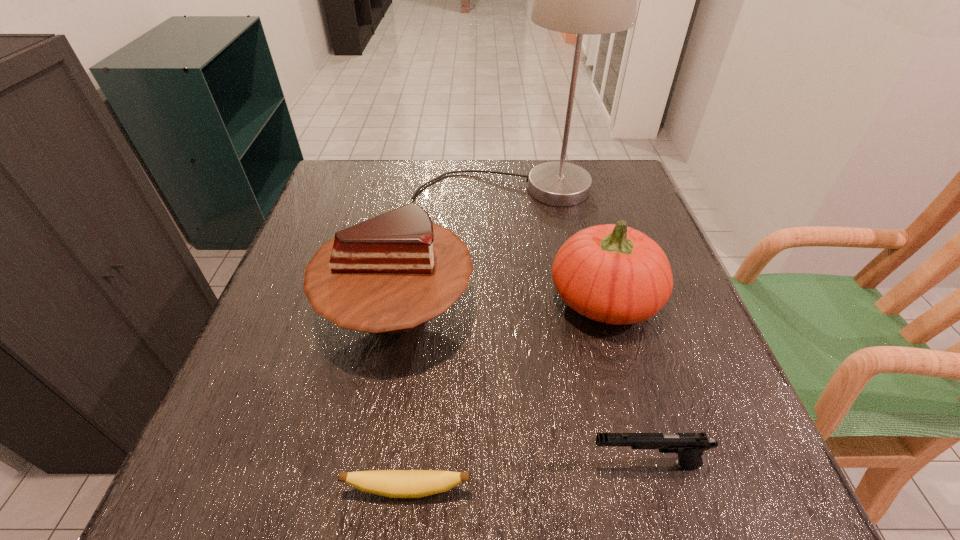
Locate which object is the second closest to the tallest object. Please provide its 2D coordinates. Your answer should be formatted as a tuple, i.e. [(x, y)], where the tuple contains the x and y coordinates of a point satisfying the conditions above.

[(611, 273)]

Identify the location of object that can be found as the third closest to the banana. This screenshot has width=960, height=540. (611, 273).

Locate an element on the screen. The image size is (960, 540). free space that satisfies the following two spatial constraints: 1. on the front side of the pumpkin; 2. at the aiming end of the gun is located at coordinates (650, 464).

You are a GUI agent. You are given a task and a screenshot of the screen. Output one action in this format:
    pyautogui.click(x=<x>, y=<y>)
    Task: Click on the free space in the image that satisfies the following two spatial constraints: 1. on the back side of the pumpkin; 2. on the right side of the nearest object
    
    Given the screenshot: What is the action you would take?
    pos(429,299)

Locate an element on the screen. Image resolution: width=960 pixels, height=540 pixels. free region that satisfies the following two spatial constraints: 1. on the front side of the pumpkin; 2. on the left side of the farthest object is located at coordinates (515, 299).

The image size is (960, 540). What are the coordinates of `vacant region that satisfies the following two spatial constraints: 1. on the front side of the pumpkin; 2. at the aiming end of the gun` in the screenshot? It's located at (650, 464).

Identify the location of vacant space that satisfies the following two spatial constraints: 1. on the back side of the shortest object; 2. on the left side of the tallest object. The height and width of the screenshot is (540, 960). (442, 189).